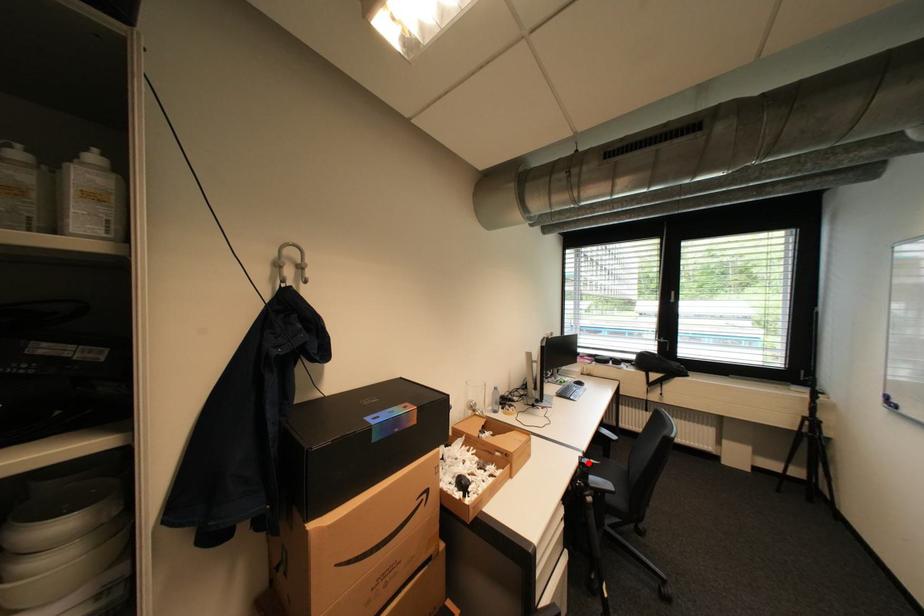
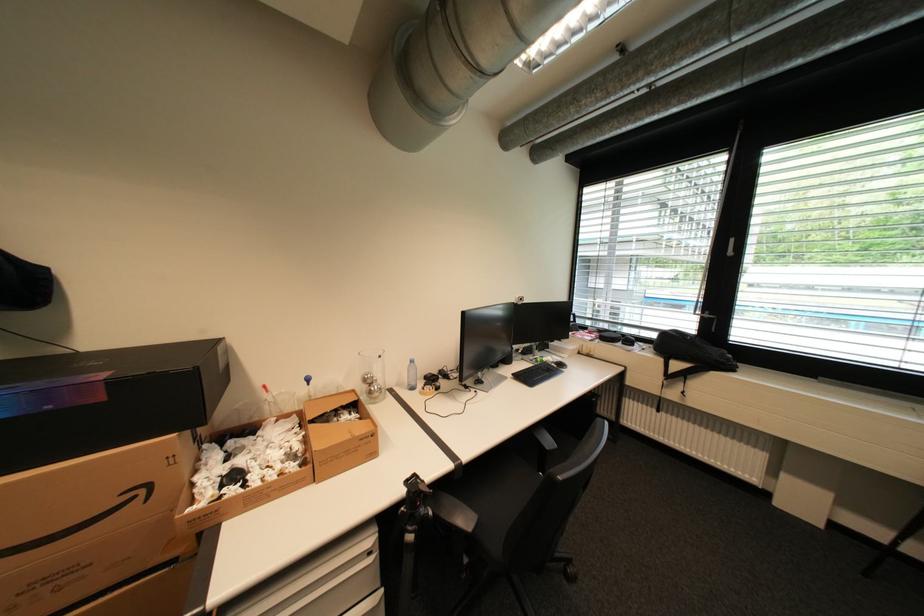
The point at the highlighted location is marked in the first image. Where is the corresponding point in the second image?

(416, 484)